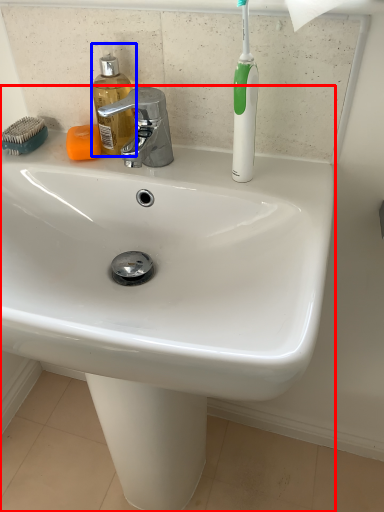
Question: Which object is closer to the camera taking this photo, sink (highlighted by a red box) or soap dispenser (highlighted by a blue box)?

Choices:
 (A) sink
 (B) soap dispenser

Answer: (A)